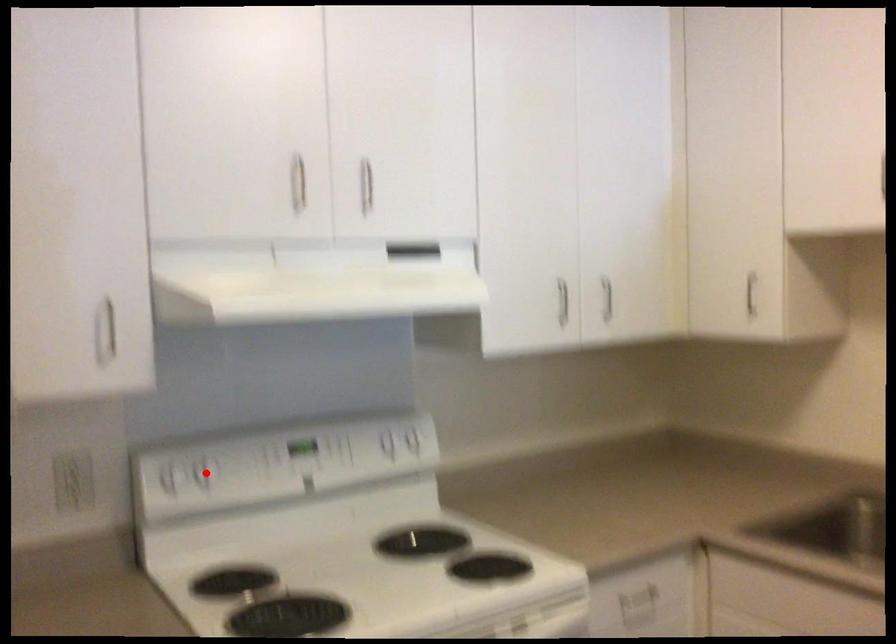
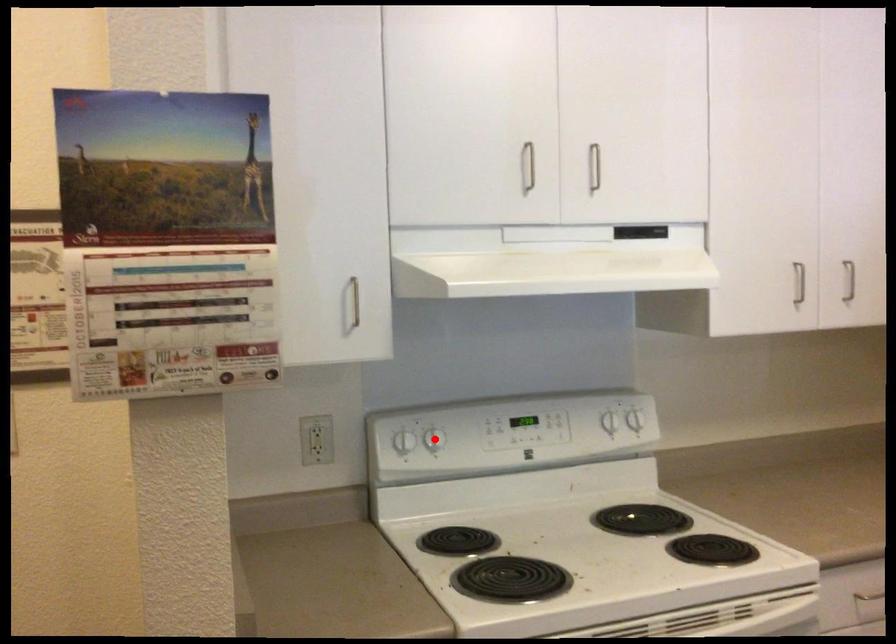
I am providing you with two images of the same scene from different viewpoints. A red point is marked on the first image and another point is marked on the second image. Is the red point in image1 aligned with the point shown in image2?

Yes